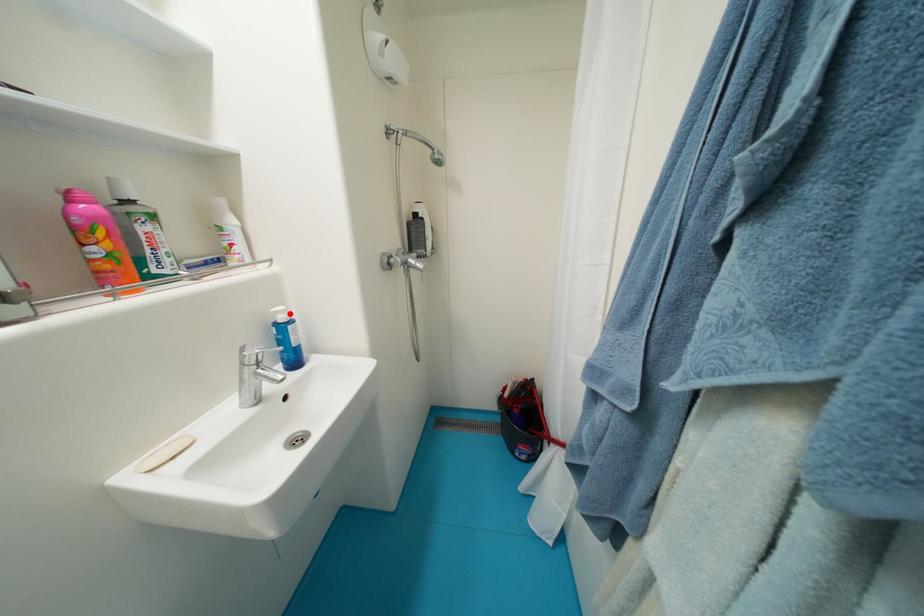
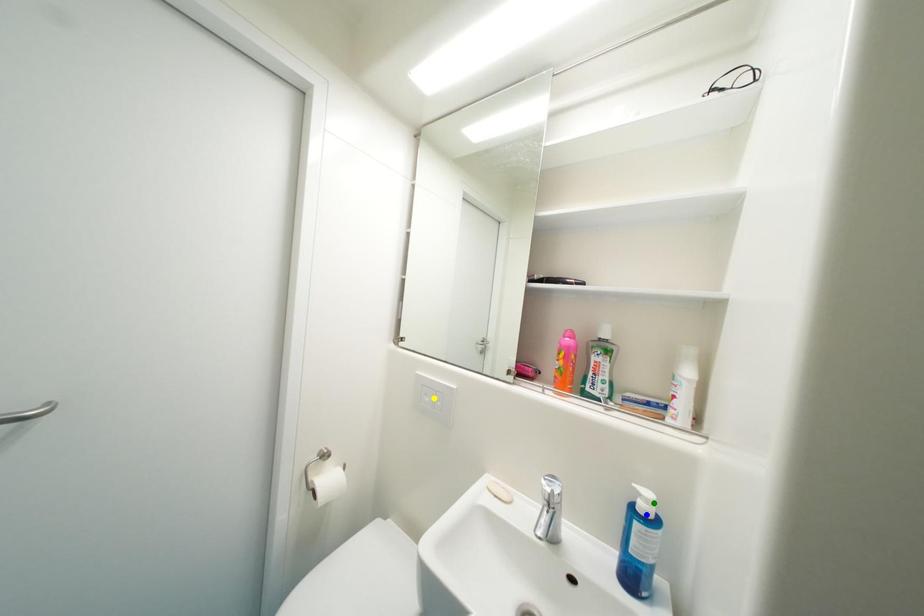
Question: I am providing you with two images of the same scene from different viewpoints. A red point is marked on the first image. You are given multiple points on the second image. Which mark in image 2 goes with the point in image 1?

Choices:
 (A) blue point
 (B) green point
 (C) yellow point

Answer: (B)